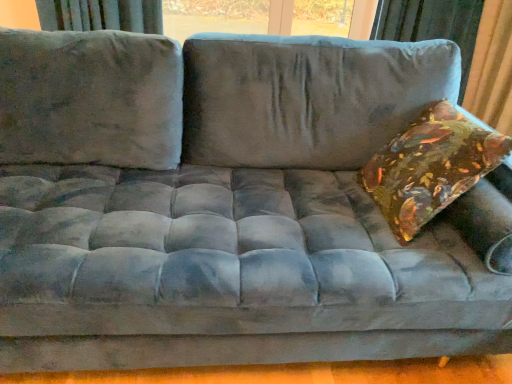
Where is `velvet curtain at upper right`? This screenshot has width=512, height=384. velvet curtain at upper right is located at coordinates (431, 25).

This screenshot has height=384, width=512. What do you see at coordinates (431, 25) in the screenshot?
I see `velvet curtain at upper right` at bounding box center [431, 25].

This screenshot has height=384, width=512. Describe the element at coordinates (431, 167) in the screenshot. I see `shiny metallic pillow at right` at that location.

Locate an element on the screen. This screenshot has height=384, width=512. shiny metallic pillow at right is located at coordinates (431, 167).

You are a GUI agent. You are given a task and a screenshot of the screen. Output one action in this format:
    pyautogui.click(x=<x>, y=<y>)
    Task: Click on the velvet curtain at upper right
    The height and width of the screenshot is (384, 512).
    Given the screenshot: What is the action you would take?
    pyautogui.click(x=431, y=25)

Considering the relative positions of shiny metallic pillow at right and velvet curtain at upper right in the image provided, is shiny metallic pillow at right to the left of velvet curtain at upper right from the viewer's perspective?

Correct, you'll find shiny metallic pillow at right to the left of velvet curtain at upper right.

Is shiny metallic pillow at right behind velvet curtain at upper right?

No, the depth of shiny metallic pillow at right is less than that of velvet curtain at upper right.

Does point (442, 108) lie behind point (403, 6)?

No.

From the image's perspective, between shiny metallic pillow at right and velvet curtain at upper right, which one is located above?

velvet curtain at upper right is shown above in the image.

From a real-world perspective, which is physically below, shiny metallic pillow at right or velvet curtain at upper right?

From a 3D spatial view, velvet curtain at upper right is below.

Considering the relative sizes of shiny metallic pillow at right and velvet curtain at upper right in the image provided, is shiny metallic pillow at right thinner than velvet curtain at upper right?

Correct, the width of shiny metallic pillow at right is less than that of velvet curtain at upper right.

Is shiny metallic pillow at right shorter than velvet curtain at upper right?

Indeed, shiny metallic pillow at right has a lesser height compared to velvet curtain at upper right.

Considering the relative sizes of shiny metallic pillow at right and velvet curtain at upper right in the image provided, is shiny metallic pillow at right bigger than velvet curtain at upper right?

Incorrect, shiny metallic pillow at right is not larger than velvet curtain at upper right.

Is shiny metallic pillow at right positioned beyond the bounds of velvet curtain at upper right?

shiny metallic pillow at right lies outside velvet curtain at upper right's area.

Is shiny metallic pillow at right placed right next to velvet curtain at upper right?

They are not placed beside each other.

Could you tell me if shiny metallic pillow at right is turned towards velvet curtain at upper right?

No, shiny metallic pillow at right is not facing towards velvet curtain at upper right.

What's the angular difference between shiny metallic pillow at right and velvet curtain at upper right's facing directions?

There is a 87-degree angle between the facing directions of shiny metallic pillow at right and velvet curtain at upper right.

This screenshot has height=384, width=512. What are the coordinates of `curtain above the shiny metallic pillow at right (from the image's perspective)` in the screenshot? It's located at (431, 25).

Which object is positioned more to the left, velvet curtain at upper right or shiny metallic pillow at right?

shiny metallic pillow at right.

Does velvet curtain at upper right lie behind shiny metallic pillow at right?

Yes, it is behind shiny metallic pillow at right.

Considering the positions of points (389, 6) and (409, 151), is point (389, 6) closer to camera compared to point (409, 151)?

No, it is not.

From the image's perspective, is velvet curtain at upper right under shiny metallic pillow at right?

No, from the image's perspective, velvet curtain at upper right is not beneath shiny metallic pillow at right.

From a real-world perspective, which object stands above the other?

shiny metallic pillow at right.

Considering the relative sizes of velvet curtain at upper right and shiny metallic pillow at right in the image provided, is velvet curtain at upper right thinner than shiny metallic pillow at right?

No, velvet curtain at upper right is not thinner than shiny metallic pillow at right.

Considering the sizes of objects velvet curtain at upper right and shiny metallic pillow at right in the image provided, who is shorter, velvet curtain at upper right or shiny metallic pillow at right?

With less height is shiny metallic pillow at right.

Is velvet curtain at upper right bigger or smaller than shiny metallic pillow at right?

In the image, velvet curtain at upper right appears to be larger than shiny metallic pillow at right.

Would you say velvet curtain at upper right contains shiny metallic pillow at right?

That's incorrect, shiny metallic pillow at right is not inside velvet curtain at upper right.

Is velvet curtain at upper right next to shiny metallic pillow at right?

They are not placed beside each other.

Is velvet curtain at upper right aimed at shiny metallic pillow at right?

Yes, velvet curtain at upper right faces towards shiny metallic pillow at right.

How many degrees apart are the facing directions of velvet curtain at upper right and shiny metallic pillow at right?

The angle between the facing direction of velvet curtain at upper right and the facing direction of shiny metallic pillow at right is 87 degrees.

Where is `curtain lying behind the shiny metallic pillow at right`? The image size is (512, 384). curtain lying behind the shiny metallic pillow at right is located at coordinates pyautogui.click(x=431, y=25).

What are the coordinates of `throw pillow above the velvet curtain at upper right (from a real-world perspective)` in the screenshot? It's located at (431, 167).

Locate an element on the screen. throw pillow below the velvet curtain at upper right (from the image's perspective) is located at coordinates (431, 167).